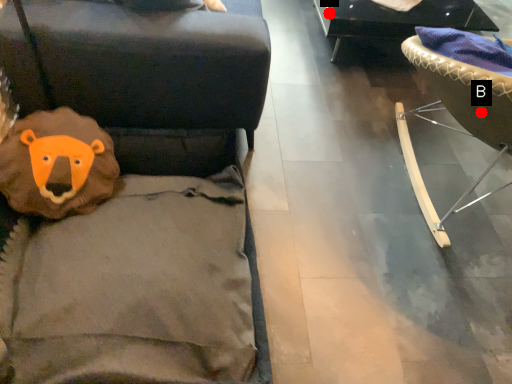
Question: Two points are circled on the image, labeled by A and B beside each circle. Which point appears farthest from the camera in this image?

Choices:
 (A) A is further
 (B) B is further

Answer: (A)